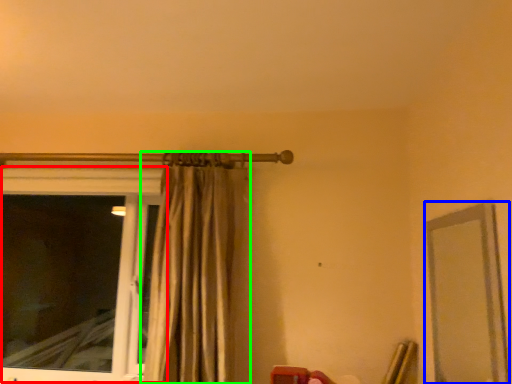
Question: Which is nearer to the window (highlighted by a red box)? mirror (highlighted by a blue box) or curtain (highlighted by a green box).

Choices:
 (A) mirror
 (B) curtain

Answer: (B)